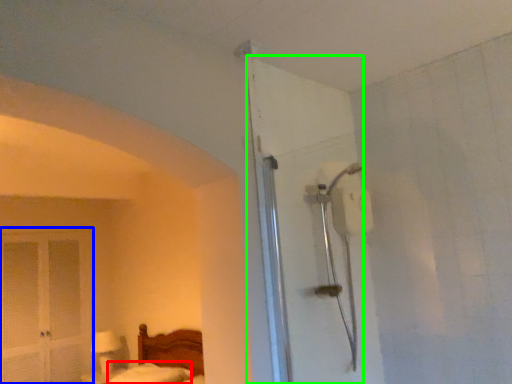
Question: Which object is positioned closest to mattress (highlighted by a red box)? Select from screen door (highlighted by a blue box) and door (highlighted by a green box).

Choices:
 (A) screen door
 (B) door

Answer: (A)